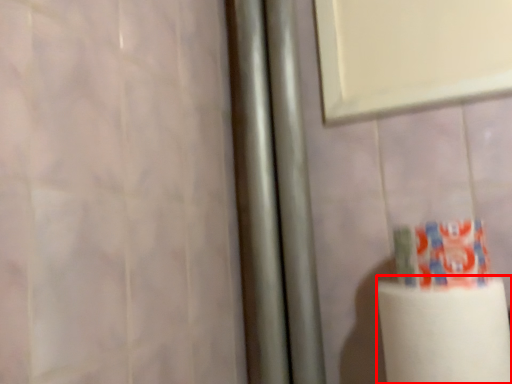
Question: From the image's perspective, considering the relative positions of paper towel (annotated by the red box) and toothpaste in the image provided, where is paper towel (annotated by the red box) located with respect to the staircase?

Choices:
 (A) above
 (B) below

Answer: (B)